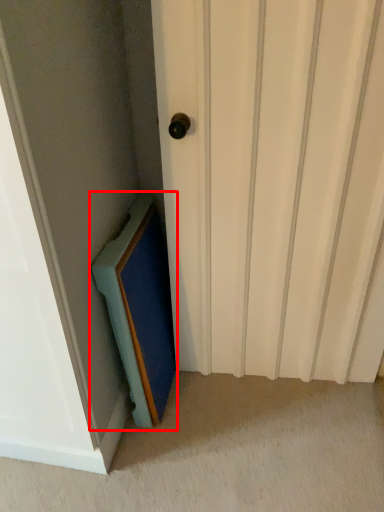
Question: From the image's perspective, considering the relative positions of medicine cabinet (annotated by the red box) and door in the image provided, where is medicine cabinet (annotated by the red box) located with respect to the staircase?

Choices:
 (A) below
 (B) above

Answer: (A)